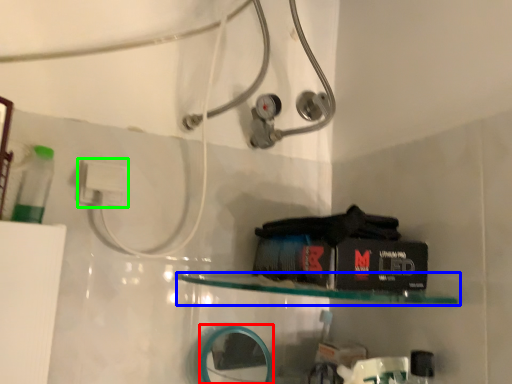
Question: Which is farther away from mirror (highlighted by a red box)? shelf (highlighted by a blue box) or electric outlet (highlighted by a green box)?

Choices:
 (A) shelf
 (B) electric outlet

Answer: (B)